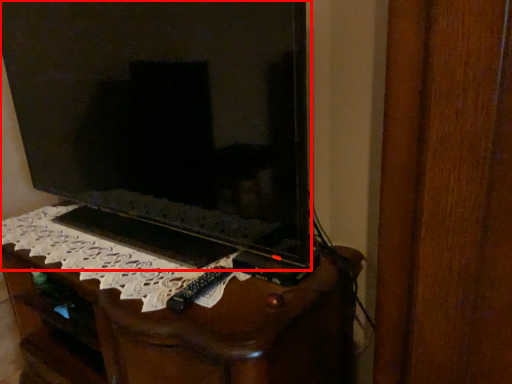
Question: From the image's perspective, where is television (annotated by the red box) located in relation to furniture in the image?

Choices:
 (A) below
 (B) above

Answer: (B)